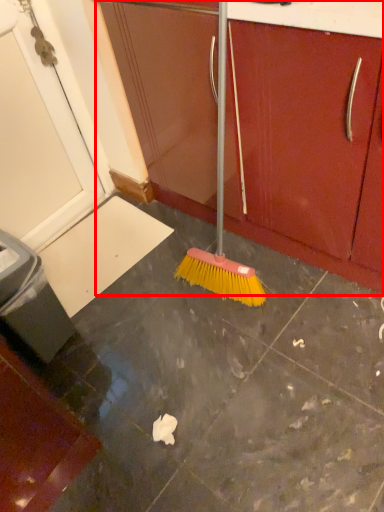
Question: From the image's perspective, where is cabinetry (annotated by the red box) located in relation to drawer in the image?

Choices:
 (A) above
 (B) below

Answer: (A)